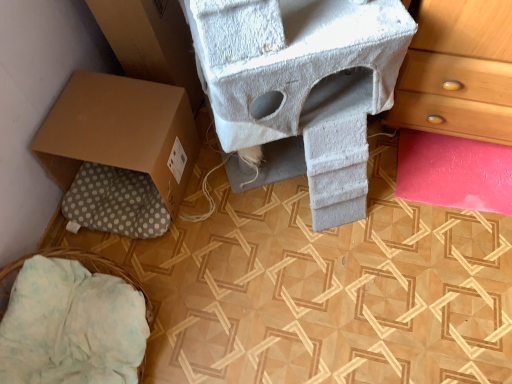
Identify the location of white fabric basket at lower left. (85, 266).

Locate an element on the screen. The height and width of the screenshot is (384, 512). brown cardboard box at left is located at coordinates (151, 42).

Identify the location of white fabric basket at lower left. Image resolution: width=512 pixels, height=384 pixels. 85,266.

Are brown cardboard box at left and brown cardboard box at lower left located far from each other?

No, brown cardboard box at left is not far from brown cardboard box at lower left.

Considering their positions, is brown cardboard box at left located in front of or behind brown cardboard box at lower left?

Visually, brown cardboard box at left is located behind brown cardboard box at lower left.

Is point (152, 46) farther from camera compared to point (126, 167)?

Yes, it is behind point (126, 167).

From the image's perspective, which one is positioned higher, brown cardboard box at left or brown cardboard box at lower left?

brown cardboard box at left.

How far apart are white fabric basket at lower left and brown cardboard box at left?

27.37 inches.

Is white fabric basket at lower left aimed at brown cardboard box at left?

No, white fabric basket at lower left is not aimed at brown cardboard box at left.

From the image's perspective, would you say white fabric basket at lower left is positioned over brown cardboard box at left?

No, from the image's perspective, white fabric basket at lower left is not on top of brown cardboard box at left.

Which object is more forward, white fabric basket at lower left or brown cardboard box at left?

white fabric basket at lower left is more forward.

This screenshot has height=384, width=512. I want to click on cardboard box that appears above the brown cardboard box at lower left (from the image's perspective), so click(151, 42).

Looking at this image, is brown cardboard box at lower left not inside brown cardboard box at left?

brown cardboard box at lower left lies outside brown cardboard box at left's area.

How different are the orientations of brown cardboard box at lower left and brown cardboard box at left in degrees?

The angle between the facing direction of brown cardboard box at lower left and the facing direction of brown cardboard box at left is 0.0003 degrees.

Does brown cardboard box at lower left contain white fabric basket at lower left?

No, white fabric basket at lower left is not surrounded by brown cardboard box at lower left.

Looking at this image, between brown cardboard box at lower left and white fabric basket at lower left, which one has less height?

white fabric basket at lower left is shorter.

Image resolution: width=512 pixels, height=384 pixels. In order to click on box on the right side of white fabric basket at lower left in this screenshot , I will do `click(120, 132)`.

Is brown cardboard box at lower left facing towards white fabric basket at lower left?

No, brown cardboard box at lower left is not aimed at white fabric basket at lower left.

Considering the positions of points (156, 78) and (152, 305), is point (156, 78) farther from camera compared to point (152, 305)?

Yes, it is.

Considering the positions of objects brown cardboard box at left and white fabric basket at lower left in the image provided, who is in front, brown cardboard box at left or white fabric basket at lower left?

white fabric basket at lower left.

Are brown cardboard box at left and white fabric basket at lower left located far from each other?

That's not correct — brown cardboard box at left is a little close to white fabric basket at lower left.

From a real-world perspective, which is physically above, brown cardboard box at left or white fabric basket at lower left?

brown cardboard box at left is physically above.

Can you confirm if white fabric basket at lower left is positioned to the right of brown cardboard box at lower left?

In fact, white fabric basket at lower left is to the left of brown cardboard box at lower left.

Looking at this image, from a real-world perspective, is white fabric basket at lower left positioned over brown cardboard box at lower left based on gravity?

No, from a real-world perspective, white fabric basket at lower left is not above brown cardboard box at lower left.

Based on the photo, how much distance is there between white fabric basket at lower left and brown cardboard box at lower left?

The distance of white fabric basket at lower left from brown cardboard box at lower left is 14.74 inches.

Do you think white fabric basket at lower left is within brown cardboard box at lower left, or outside of it?

white fabric basket at lower left is not enclosed by brown cardboard box at lower left.

Find the location of a particular element. This screenshot has height=384, width=512. box located on the left of brown cardboard box at left is located at coordinates (120, 132).

The height and width of the screenshot is (384, 512). In order to click on basket that appears below the brown cardboard box at left (from a real-world perspective) in this screenshot , I will do `click(85, 266)`.

Estimate the real-world distances between objects in this image. Which object is further from brown cardboard box at lower left, brown cardboard box at left or white fabric basket at lower left?

white fabric basket at lower left is positioned further to the anchor brown cardboard box at lower left.

Estimate the real-world distances between objects in this image. Which object is closer to brown cardboard box at left, brown cardboard box at lower left or white fabric basket at lower left?

brown cardboard box at lower left lies closer to brown cardboard box at left than the other object.

In the scene shown: Looking at the image, which one is located closer to brown cardboard box at left, white fabric basket at lower left or brown cardboard box at lower left?

Based on the image, brown cardboard box at lower left appears to be nearer to brown cardboard box at left.

Consider the image. Considering their positions, is brown cardboard box at left positioned closer to white fabric basket at lower left than brown cardboard box at lower left?

brown cardboard box at lower left is closer to white fabric basket at lower left.

From the image, which object appears to be nearer to brown cardboard box at lower left, white fabric basket at lower left or brown cardboard box at left?

Based on the image, brown cardboard box at left appears to be nearer to brown cardboard box at lower left.

Consider the image. When comparing their distances from white fabric basket at lower left, does brown cardboard box at lower left or brown cardboard box at left seem closer?

brown cardboard box at lower left.

The height and width of the screenshot is (384, 512). In order to click on box that lies between brown cardboard box at left and white fabric basket at lower left from top to bottom in this screenshot , I will do `click(120, 132)`.